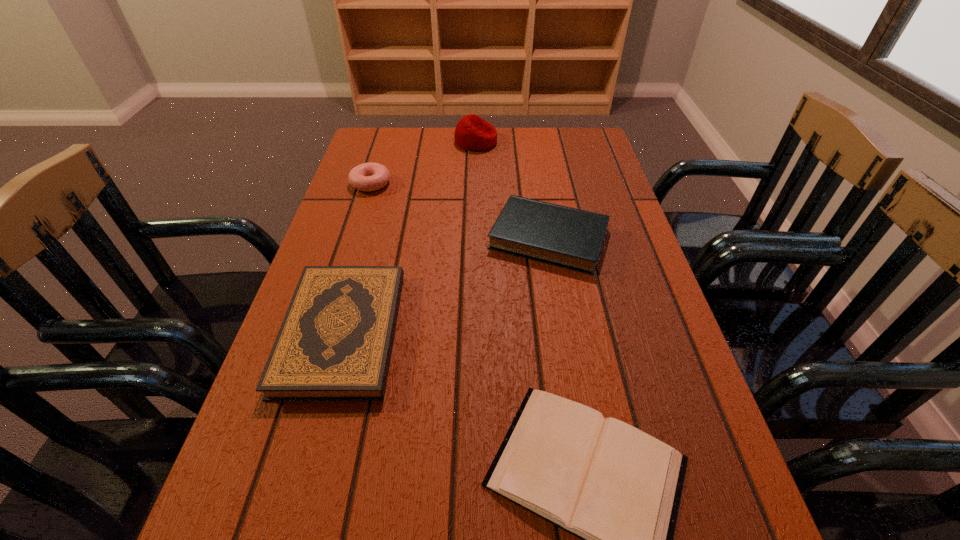
This screenshot has height=540, width=960. I want to click on beanbag, so click(x=472, y=133).

You are a GUI agent. You are given a task and a screenshot of the screen. Output one action in this format:
    pyautogui.click(x=<x>, y=<y>)
    Task: Click on the farthest object
    The image size is (960, 540).
    Given the screenshot: What is the action you would take?
    tap(472, 133)

Identify the location of the third nearest object. The width and height of the screenshot is (960, 540). (571, 238).

At what (x,y) coordinates should I click in order to perform the action: click on the fourth nearest object. Please return your answer as a coordinate pair (x, y). Looking at the image, I should click on (367, 177).

I want to click on the leftmost hardback book, so click(x=335, y=342).

Find the location of a particular element. The width and height of the screenshot is (960, 540). vacant space positioned 0.280m on the seat area of the tallest object is located at coordinates (585, 141).

Locate an element on the screen. This screenshot has height=540, width=960. vacant area situated 0.340m on the front of the third nearest object is located at coordinates (579, 418).

The height and width of the screenshot is (540, 960). Find the location of `blank space located 0.380m on the right of the fourth nearest object`. blank space located 0.380m on the right of the fourth nearest object is located at coordinates (526, 183).

This screenshot has width=960, height=540. Identify the location of free spot located on the back of the leftmost hardback book. (383, 186).

Where is `object at the far edge`? The image size is (960, 540). object at the far edge is located at coordinates (472, 133).